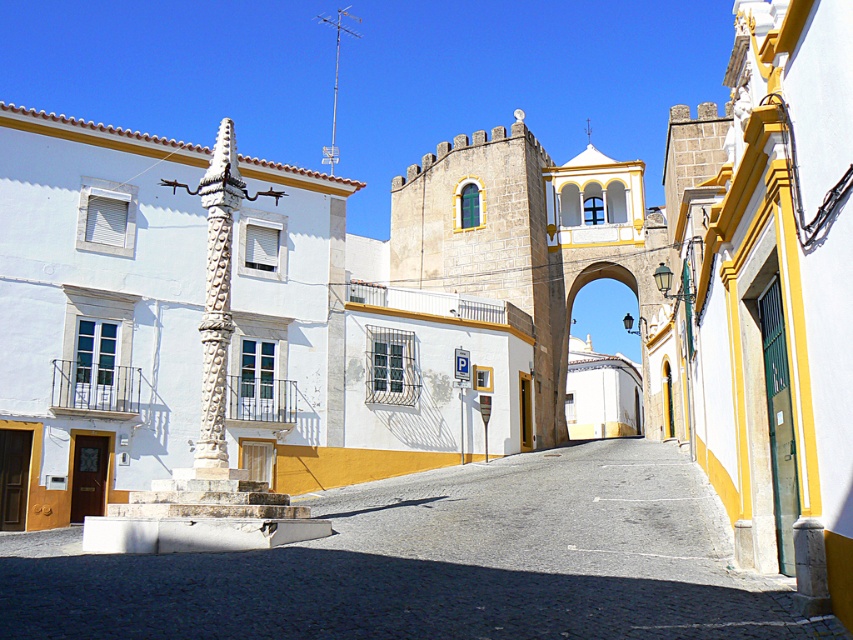
You are a tourist walking down the street and want to take a photo of both the smooth stone alley at center and the white stone archway at center. Which object should you stand closer to in order to capture both in your camera frame?

To capture both the smooth stone alley at center and the white stone archway at center in your camera frame, you should stand closer to the smooth stone alley at center since it is positioned on the left side of the white stone archway at center.

You are a tourist standing at the entrance of the street. You want to take a photo of the white stone column at center without any obstructions. Which path should you choose to walk towards the column, the smooth stone alley at center or another path?

You should choose the smooth stone alley at center because it is in front of the white stone column at center, meaning it provides a clear path to reach the column without obstructions.